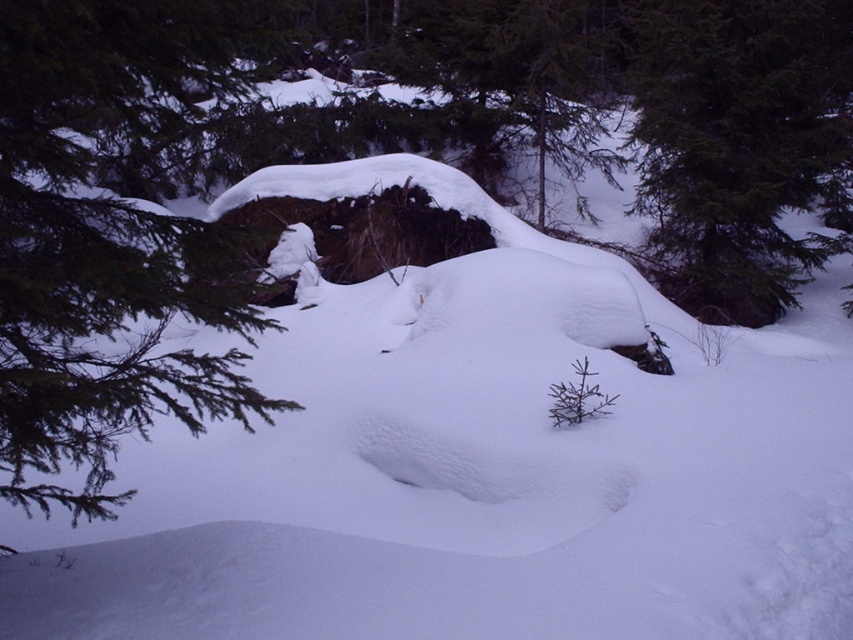
Who is more forward, (91, 460) or (688, 97)?

Point (91, 460) is in front.

How distant is green textured pine branch at left from green textured tree at upper right?

green textured pine branch at left is 8.19 meters from green textured tree at upper right.

Is point (175, 19) positioned before point (767, 65)?

Yes, point (175, 19) is in front of point (767, 65).

The image size is (853, 640). I want to click on green textured pine branch at left, so [x=107, y=243].